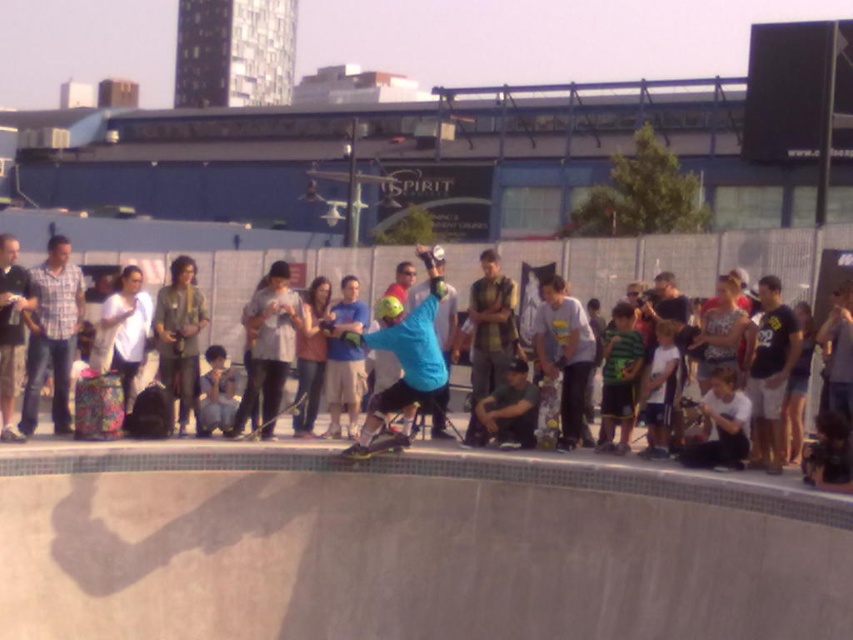
Question: Which point is closer to the camera taking this photo?

Choices:
 (A) (300, 396)
 (B) (409, 442)

Answer: (B)

Question: Which point appears closest to the camera in this image?

Choices:
 (A) (556, 404)
 (B) (10, 387)

Answer: (B)

Question: Which is nearer to the plaid shirt at left?

Choices:
 (A) floral-patterned skateboard at center
 (B) matte black skateboarder at center

Answer: (A)

Question: Can you confirm if smooth concrete skate park at center is thinner than green helmet at center?

Choices:
 (A) yes
 (B) no

Answer: (B)

Question: In this image, where is light blue t-shirt at center located relative to black matte skateboard at center?

Choices:
 (A) below
 (B) above

Answer: (B)

Question: Is light blue t-shirt at center further to camera compared to wooden skateboard at center?

Choices:
 (A) no
 (B) yes

Answer: (A)